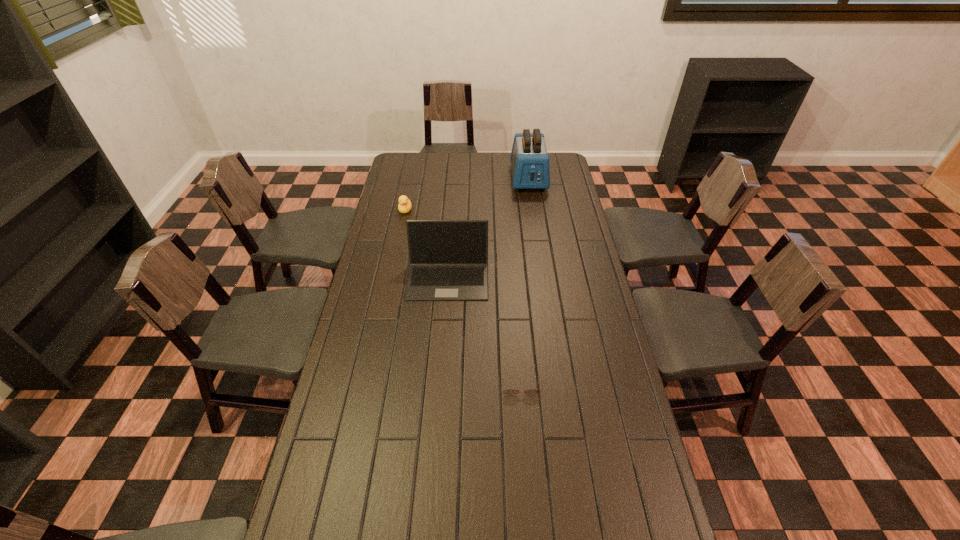
Identify the location of free area in between the sunglasses and the farthest object. (524, 281).

This screenshot has height=540, width=960. In order to click on blank region between the shortest object and the farthest object in this screenshot , I will do `click(524, 281)`.

At what (x,y) coordinates should I click in order to perform the action: click on empty space between the tallest object and the shortest object. Please return your answer as a coordinate pair (x, y). This screenshot has height=540, width=960. Looking at the image, I should click on (524, 281).

This screenshot has height=540, width=960. What are the coordinates of `free spot between the third shortest object and the tallest object` in the screenshot? It's located at (489, 228).

You are a GUI agent. You are given a task and a screenshot of the screen. Output one action in this format:
    pyautogui.click(x=<x>, y=<y>)
    Task: Click on the free space between the shortest object and the third object from right to left
    This screenshot has height=540, width=960.
    Given the screenshot: What is the action you would take?
    pyautogui.click(x=484, y=330)

Choose which object is the third nearest neighbor to the nearest object. Please provide its 2D coordinates. Your answer should be formatted as a tuple, i.e. [(x, y)], where the tuple contains the x and y coordinates of a point satisfying the conditions above.

[(529, 159)]

What are the coordinates of `the third closest object to the shortest object` in the screenshot? It's located at (529, 159).